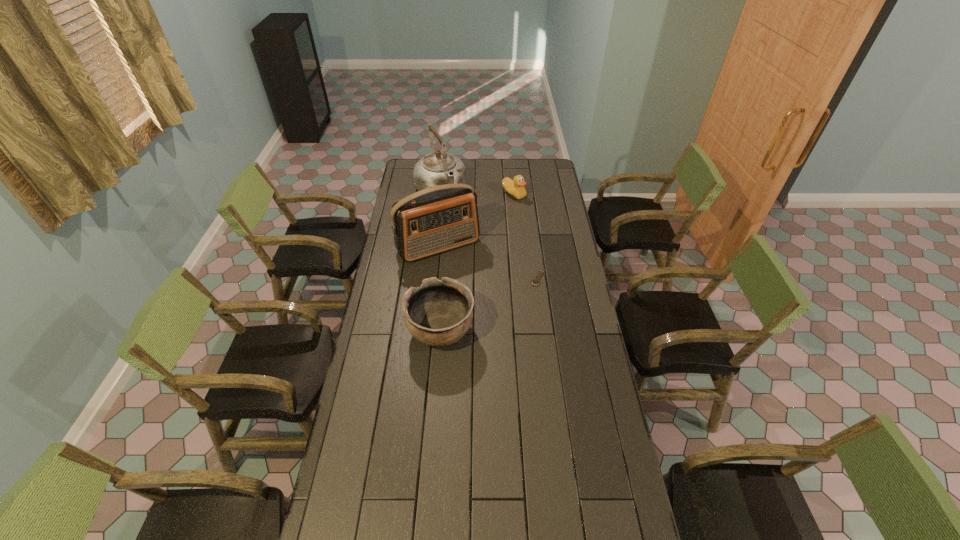
Locate an element on the screen. vacant region that satisfies the following two spatial constraints: 1. on the front side of the third nearest object; 2. on the right side of the third shortest object is located at coordinates (430, 332).

Image resolution: width=960 pixels, height=540 pixels. I want to click on vacant position in the image that satisfies the following two spatial constraints: 1. on the back side of the duck; 2. on the right side of the nearest object, so click(452, 194).